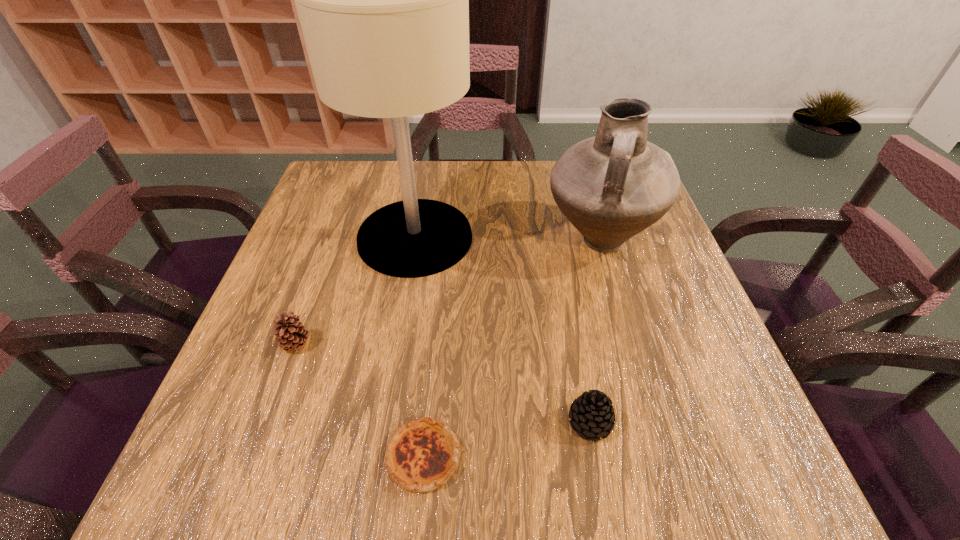
Find the location of a particular element. The width and height of the screenshot is (960, 540). free spot located 0.300m on the left of the shortest object is located at coordinates (197, 456).

At what (x,y) coordinates should I click in order to perform the action: click on table lamp that is at the far edge. Please return your answer as a coordinate pair (x, y). The image size is (960, 540). Looking at the image, I should click on (383, 0).

Identify the location of pitcher that is at the far edge. This screenshot has height=540, width=960. (611, 187).

This screenshot has width=960, height=540. I want to click on pinecone that is at the near edge, so click(592, 414).

Where is `quiche positioned at the near edge`? The width and height of the screenshot is (960, 540). quiche positioned at the near edge is located at coordinates (422, 455).

This screenshot has height=540, width=960. I want to click on table lamp at the left edge, so click(383, 0).

What are the coordinates of `pinecone located at the left edge` in the screenshot? It's located at (291, 335).

Find the location of a particular element. object at the right edge is located at coordinates (x=611, y=187).

This screenshot has width=960, height=540. I want to click on object located at the far left corner, so click(383, 0).

Find the location of `object that is at the far right corner`. object that is at the far right corner is located at coordinates point(611,187).